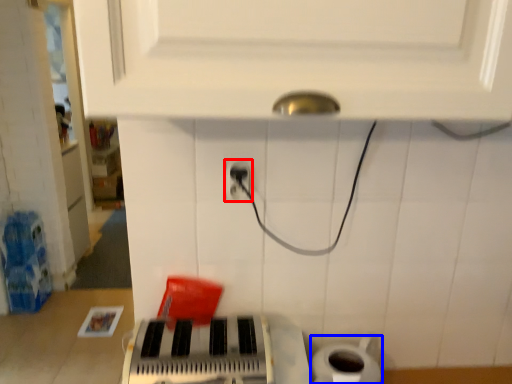
Question: Among these objects, which one is nearest to the camera, power plugs and sockets (highlighted by a red box) or toilet paper (highlighted by a blue box)?

Choices:
 (A) power plugs and sockets
 (B) toilet paper

Answer: (A)